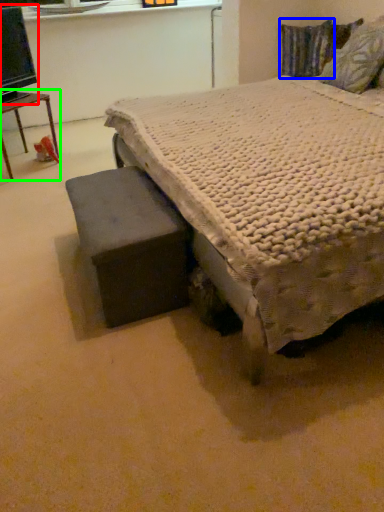
Question: Based on their relative distances, which object is farther from computer monitor (highlighted by a red box)? Choose from pillow (highlighted by a blue box) and table (highlighted by a green box).

Choices:
 (A) pillow
 (B) table

Answer: (A)